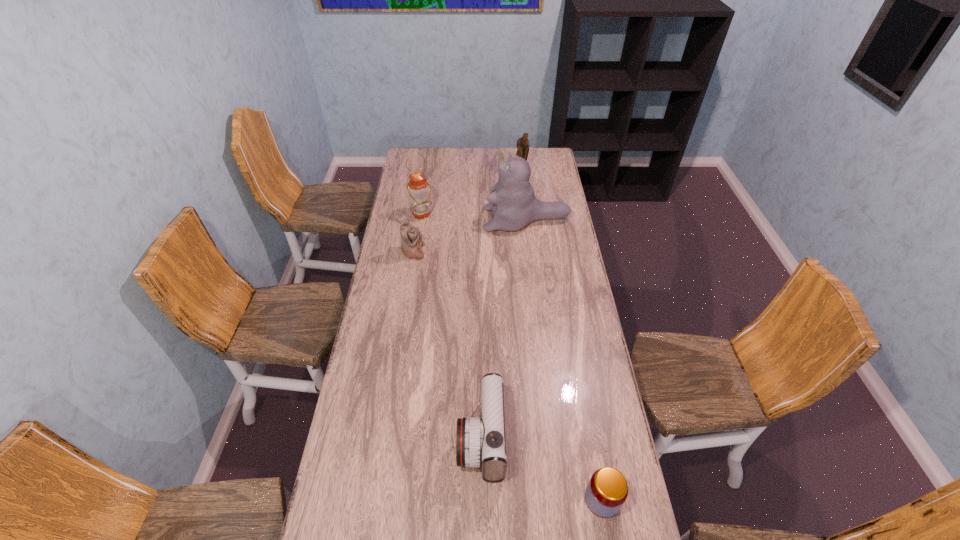
This screenshot has width=960, height=540. I want to click on empty location between the fourth farthest object and the farther figurine, so click(467, 212).

What are the coordinates of `free space between the cat and the oil lamp` in the screenshot? It's located at (474, 217).

The height and width of the screenshot is (540, 960). Identify the location of free area in between the oil lamp and the cat. (474, 217).

Locate which object is the second closest to the camcorder. Please provide its 2D coordinates. Your answer should be formatted as a tuple, i.e. [(x, y)], where the tuple contains the x and y coordinates of a point satisfying the conditions above.

[(411, 238)]

Point out which object is positioned as the fourth nearest to the oil lamp. Please provide its 2D coordinates. Your answer should be formatted as a tuple, i.e. [(x, y)], where the tuple contains the x and y coordinates of a point satisfying the conditions above.

[(480, 442)]

Locate an element on the screen. The height and width of the screenshot is (540, 960). free space that satisfies the following two spatial constraints: 1. on the front-facing side of the right figurine; 2. on the front-facing side of the fourth farthest object is located at coordinates (530, 252).

Where is `vacant space that satisfies the following two spatial constraints: 1. on the front-facing side of the shortest object; 2. on the right side of the nearer figurine`? vacant space that satisfies the following two spatial constraints: 1. on the front-facing side of the shortest object; 2. on the right side of the nearer figurine is located at coordinates (373, 500).

Where is `free space that satisfies the following two spatial constraints: 1. on the front-facing side of the farther figurine; 2. on the front-facing side of the nearer figurine`? This screenshot has height=540, width=960. free space that satisfies the following two spatial constraints: 1. on the front-facing side of the farther figurine; 2. on the front-facing side of the nearer figurine is located at coordinates (530, 252).

Find the location of a particular element. The image size is (960, 540). free spot that satisfies the following two spatial constraints: 1. on the front-facing side of the shortest object; 2. on the right side of the left figurine is located at coordinates (373, 500).

Identify the location of free space in the image that satisfies the following two spatial constraints: 1. on the front-facing side of the right figurine; 2. on the face of the cat. The width and height of the screenshot is (960, 540). (526, 219).